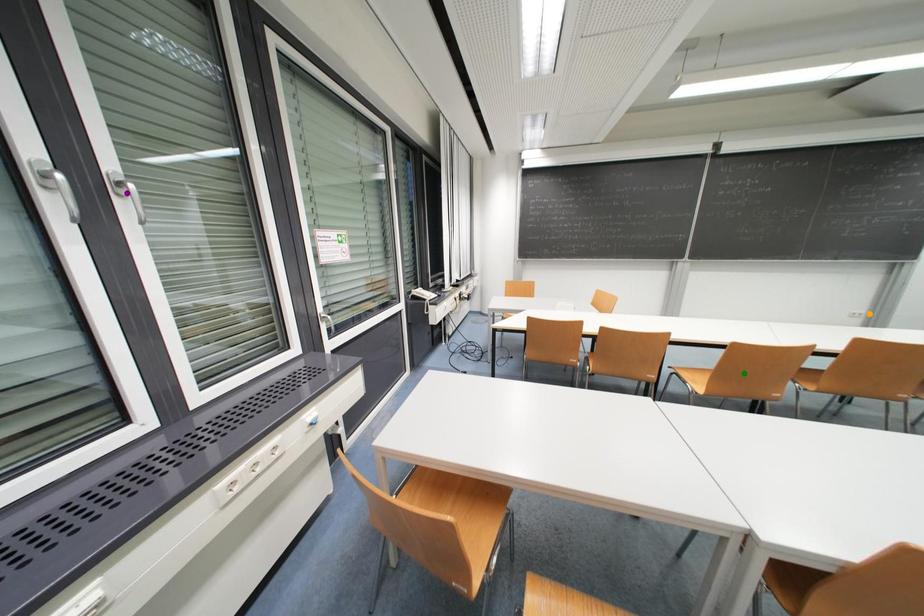
Order these from nearest to farthest:
orange point | green point | purple point

purple point < green point < orange point